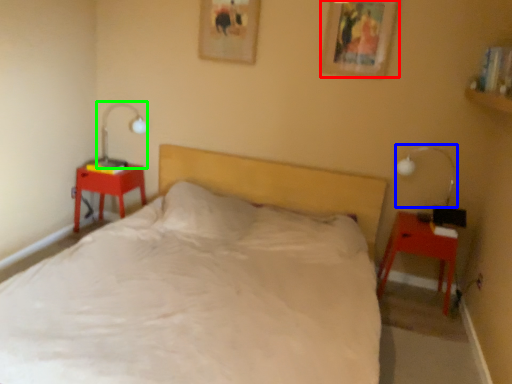
Question: Considering the real-world distances, which object is farthest from picture frame (highlighted by a red box)? bedside lamp (highlighted by a blue box) or table lamp (highlighted by a green box)?

Choices:
 (A) bedside lamp
 (B) table lamp

Answer: (B)